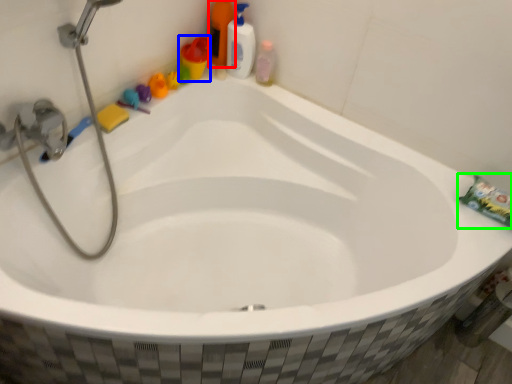
Question: Which object is positioned farthest from cleaning product (highlighted by a red box)? Select from toiletry (highlighted by a blue box) and toothpaste (highlighted by a green box).

Choices:
 (A) toiletry
 (B) toothpaste

Answer: (B)